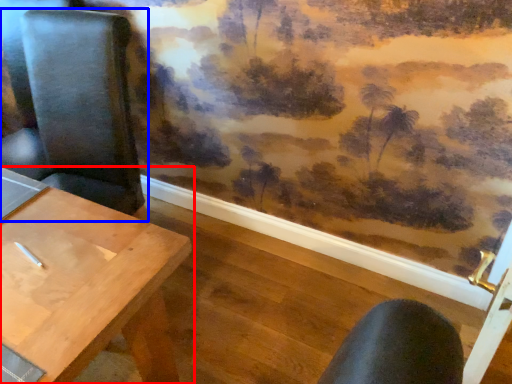
Question: Which object is further to the camera taking this photo, table (highlighted by a red box) or chair (highlighted by a blue box)?

Choices:
 (A) table
 (B) chair

Answer: (B)